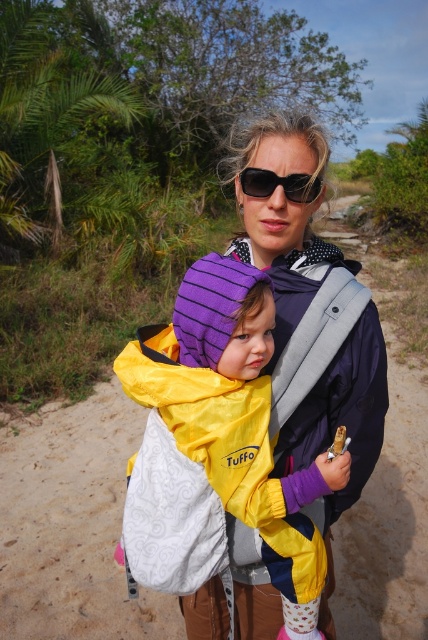
Can you confirm if yellow fabric jacket at center is thinner than matte black jacket at center?

In fact, yellow fabric jacket at center might be wider than matte black jacket at center.

Who is more distant from viewer, (246, 307) or (312, 291)?

The point (312, 291) is more distant.

The image size is (428, 640). Find the location of `yellow fabric jacket at center`. yellow fabric jacket at center is located at coordinates click(x=235, y=419).

Where is `yellow fabric jacket at center`? This screenshot has width=428, height=640. yellow fabric jacket at center is located at coordinates pos(235,419).

The width and height of the screenshot is (428, 640). What do you see at coordinates (235, 419) in the screenshot?
I see `yellow fabric jacket at center` at bounding box center [235, 419].

Can you confirm if yellow fabric jacket at center is positioned above black plastic sunglasses at center?

Actually, yellow fabric jacket at center is below black plastic sunglasses at center.

Who is more forward, (265, 385) or (244, 188)?

Point (265, 385) is in front.

Locate an element on the screen. This screenshot has height=640, width=428. yellow fabric jacket at center is located at coordinates (235, 419).

Which is above, matte black jacket at center or black plastic sunglasses at center?

black plastic sunglasses at center is higher up.

In the scene shown: Can you confirm if matte black jacket at center is bigger than black plastic sunglasses at center?

Correct, matte black jacket at center is larger in size than black plastic sunglasses at center.

This screenshot has width=428, height=640. Describe the element at coordinates (282, 212) in the screenshot. I see `matte black jacket at center` at that location.

What are the coordinates of `matte black jacket at center` in the screenshot? It's located at click(x=282, y=212).